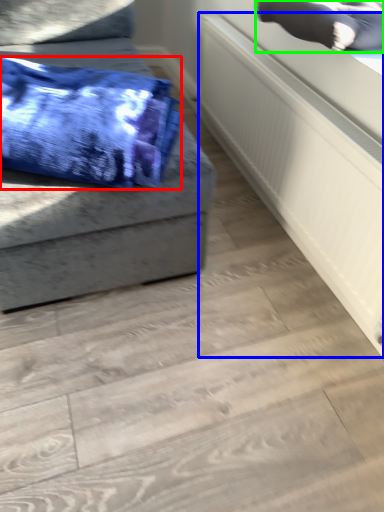
Question: Which is farther away from blanket (highlighted by a red box)? radiator (highlighted by a blue box) or pillow (highlighted by a green box)?

Choices:
 (A) radiator
 (B) pillow

Answer: (B)